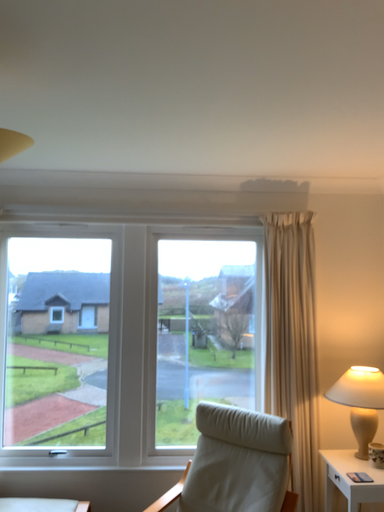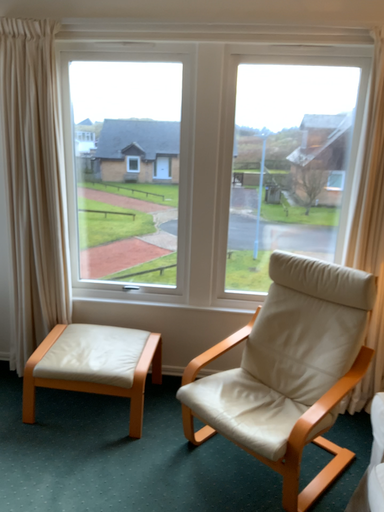
Question: Which way did the camera rotate in the video?

Choices:
 (A) rotated left
 (B) rotated right

Answer: (A)